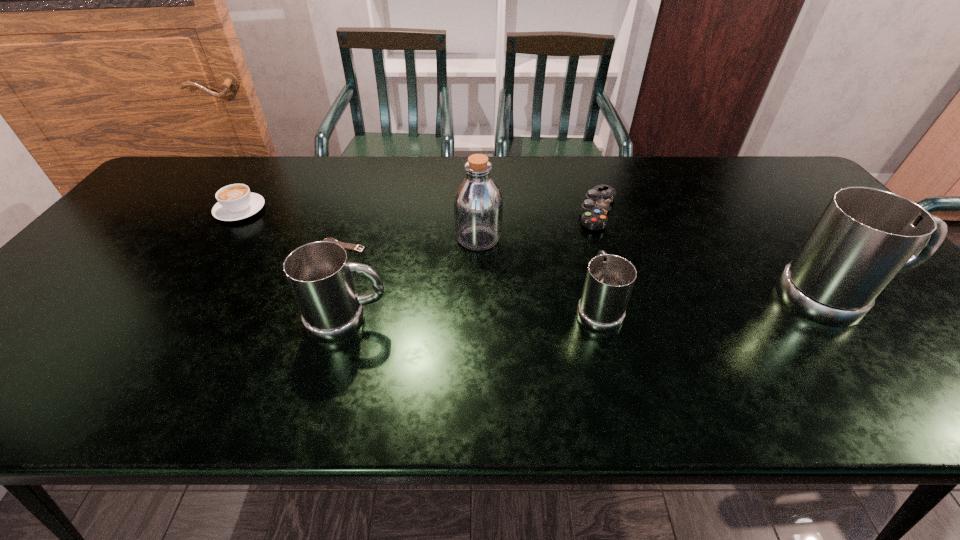
Identify the location of free space located on the back of the bottle. (478, 205).

I want to click on object present at the far edge, so click(x=594, y=209).

Where is `object at the right edge`? object at the right edge is located at coordinates (865, 236).

Find the location of a particular element. The width and height of the screenshot is (960, 540). vacant space at the far edge is located at coordinates (554, 166).

At what (x,y) coordinates should I click in order to perform the action: click on free space at the near edge of the desktop. Please return your answer as a coordinate pair (x, y). The height and width of the screenshot is (540, 960). Looking at the image, I should click on (152, 336).

This screenshot has height=540, width=960. Identify the location of vacant space at the left edge. (178, 207).

This screenshot has height=540, width=960. I want to click on free spot at the far left corner of the desktop, so click(191, 188).

You are a GUI agent. You are given a task and a screenshot of the screen. Output one action in this format:
    pyautogui.click(x=<x>, y=<y>)
    Task: Click on the free space between the rightmost object and the second shortest object
    The height and width of the screenshot is (540, 960).
    Given the screenshot: What is the action you would take?
    pyautogui.click(x=716, y=254)

Find the location of a particular element. vacant area that lies between the fourth object from right to left and the control is located at coordinates (539, 224).

The width and height of the screenshot is (960, 540). Identify the location of free space between the sixth tallest object and the leftmost object. (420, 211).